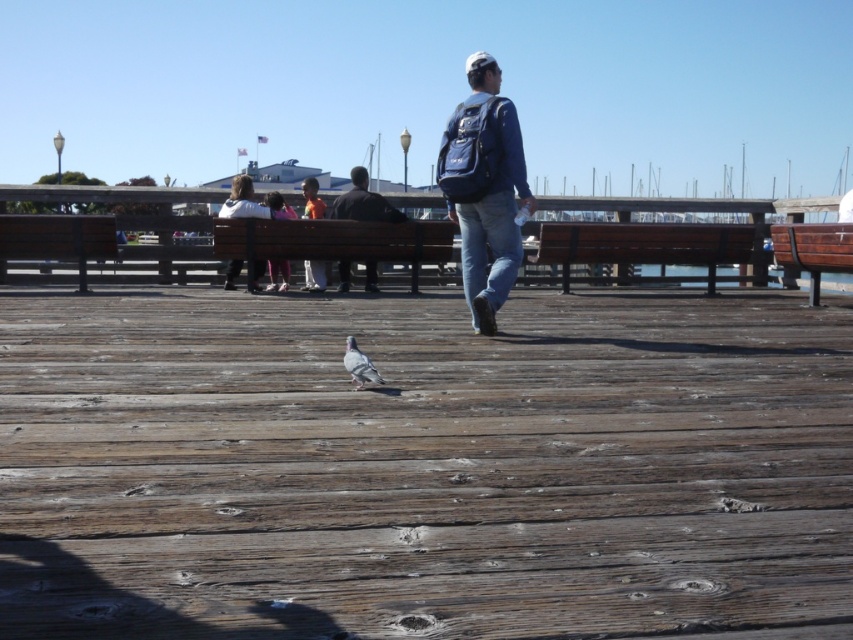
Question: Where is blue fabric backpack at center located in relation to matte pink shirt at center in the image?

Choices:
 (A) below
 (B) above

Answer: (B)

Question: Is blue fabric backpack at center positioned at the back of white cotton jacket at center?

Choices:
 (A) yes
 (B) no

Answer: (B)

Question: Among these points, which one is farthest from the camera?

Choices:
 (A) (271, 204)
 (B) (374, 209)
 (C) (93, 385)
 (D) (224, 205)

Answer: (A)

Question: Considering the real-world distances, which object is farthest from the brown wooden deck at center?

Choices:
 (A) blue fabric backpack at center
 (B) white cotton jacket at center
 (C) dark brown leather jacket at center

Answer: (B)

Question: Among these objects, which one is farthest from the camera?

Choices:
 (A) dark brown leather jacket at center
 (B) white cotton jacket at center

Answer: (A)

Question: Is brown wooden deck at center closer to camera compared to white cotton jacket at center?

Choices:
 (A) yes
 (B) no

Answer: (A)